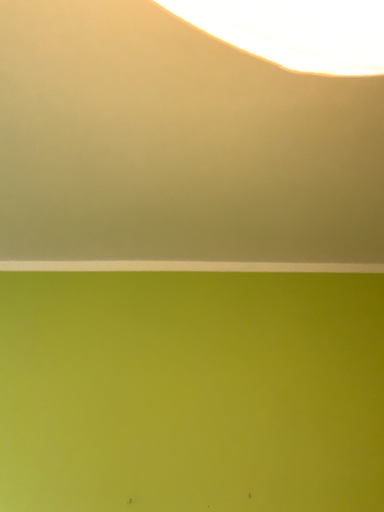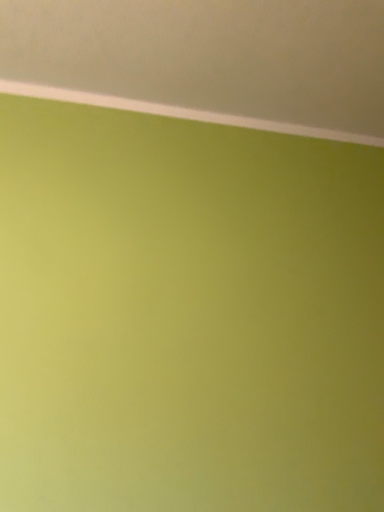
Question: Which way did the camera rotate in the video?

Choices:
 (A) rotated left
 (B) rotated right

Answer: (B)